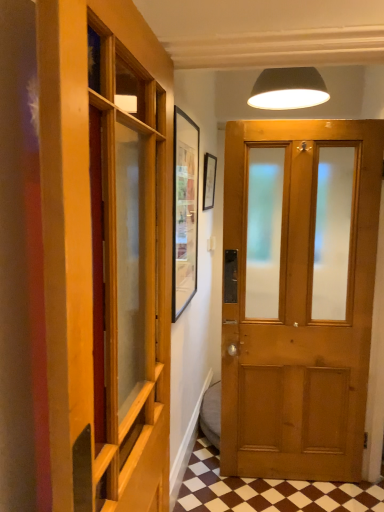
Question: Considering the positions of matte black lampshade at upper center and brown checkered tile at lower center in the image, is matte black lampshade at upper center taller or shorter than brown checkered tile at lower center?

Choices:
 (A) short
 (B) tall

Answer: (B)

Question: Which is correct: matte black lampshade at upper center is inside brown checkered tile at lower center, or outside of it?

Choices:
 (A) outside
 (B) inside

Answer: (A)

Question: Based on their relative distances, which object is nearer to the matte black lampshade at upper center?

Choices:
 (A) brown checkered tile at lower center
 (B) matte wooden door at center
 (C) wooden paneling at left

Answer: (B)

Question: Considering the real-world distances, which object is closest to the matte wooden door at center?

Choices:
 (A) matte black lampshade at upper center
 (B) brown checkered tile at lower center
 (C) wooden paneling at left

Answer: (B)